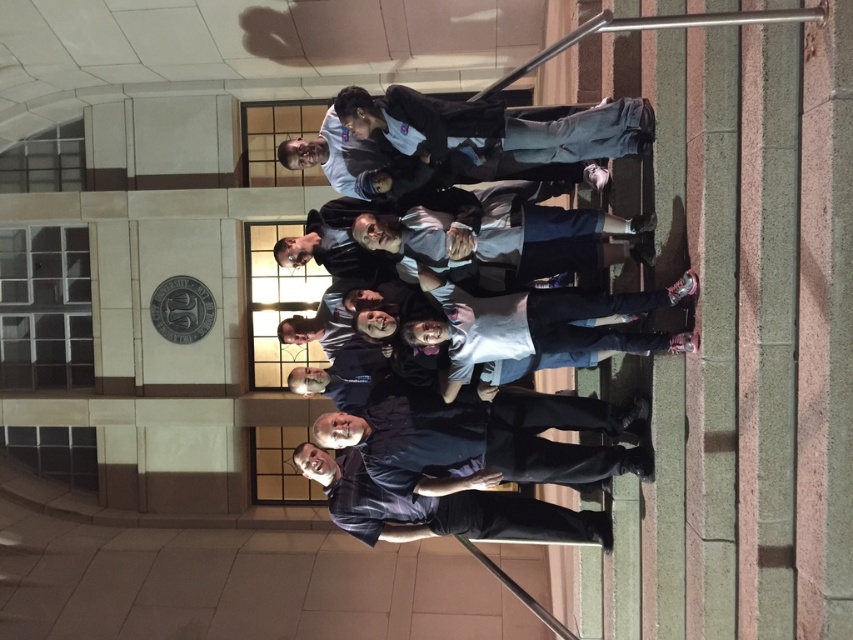
Question: Which point is closer to the camera?

Choices:
 (A) (561, 129)
 (B) (467, 296)
 (C) (543, 468)

Answer: (A)

Question: Is dark gray uniform at center wider than dark blue shirt at center?

Choices:
 (A) no
 (B) yes

Answer: (B)

Question: Which object is closer to the camera taking this photo?

Choices:
 (A) dark blue shirt at lower center
 (B) dark gray uniform at center
 (C) gray cotton shirt at center

Answer: (C)

Question: Is dark gray uniform at center thinner than dark blue shirt at center?

Choices:
 (A) no
 (B) yes

Answer: (A)

Question: Is gray cotton shirt at center further to the viewer compared to dark blue shirt at lower center?

Choices:
 (A) yes
 (B) no

Answer: (B)

Question: Which of these objects is positioned closest to the gray cotton shirt at center?

Choices:
 (A) dark blue shirt at lower center
 (B) dark blue shirt at center
 (C) dark gray uniform at center

Answer: (C)